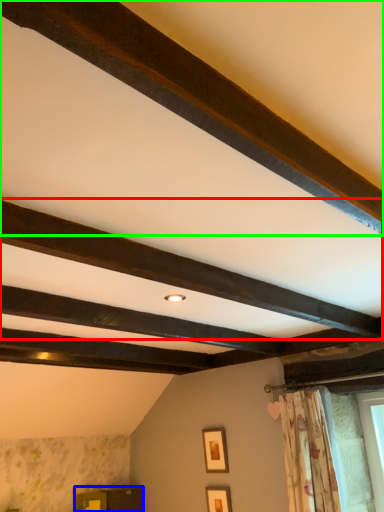
Question: Estimate the real-world distances between objects in this image. Which object is farther from plank (highlighted by a red box), furniture (highlighted by a blue box) or plank (highlighted by a green box)?

Choices:
 (A) furniture
 (B) plank

Answer: (A)